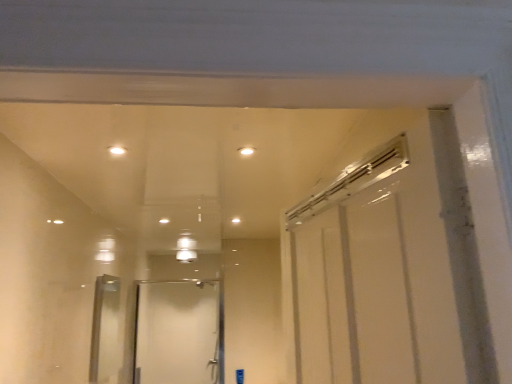
The height and width of the screenshot is (384, 512). What do you see at coordinates (246, 151) in the screenshot? I see `white glossy light at upper center, which is the 1th light from right to left` at bounding box center [246, 151].

What do you see at coordinates (117, 150) in the screenshot? I see `white glossy light at upper center, arranged as the 2th light when viewed from the right` at bounding box center [117, 150].

In order to click on clear glass door at center in this screenshot , I will do tap(177, 332).

You are a GUI agent. You are given a task and a screenshot of the screen. Output one action in this format:
    pyautogui.click(x=<x>, y=<y>)
    Task: Click on the white glossy light at upper center, which is the second light in left-to-right order
    
    Given the screenshot: What is the action you would take?
    pyautogui.click(x=246, y=151)

Is point (251, 150) closer or farther from the camera than point (120, 153)?

Point (251, 150).

Is white glossy light at upper center, which is the 1th light from right to left, bigger or smaller than white glossy light at upper center, the 1th light in the left-to-right sequence?

Considering their sizes, white glossy light at upper center, which is the 1th light from right to left, takes up less space than white glossy light at upper center, the 1th light in the left-to-right sequence.

From a real-world perspective, does white glossy light at upper center, which is the second light in left-to-right order, sit lower than white glossy light at upper center, arranged as the 2th light when viewed from the right?

Yes, from a real-world perspective, white glossy light at upper center, which is the second light in left-to-right order, is beneath white glossy light at upper center, arranged as the 2th light when viewed from the right.

From a real-world perspective, which is physically below, white glossy light at upper center, arranged as the 2th light when viewed from the right, or white glossy light at upper center, which is the 1th light from right to left?

From a 3D spatial view, white glossy light at upper center, which is the 1th light from right to left, is below.

Considering the positions of objects white glossy light at upper center, arranged as the 2th light when viewed from the right, and white glossy light at upper center, which is the 1th light from right to left, in the image provided, who is in front, white glossy light at upper center, arranged as the 2th light when viewed from the right, or white glossy light at upper center, which is the 1th light from right to left,?

white glossy light at upper center, arranged as the 2th light when viewed from the right, is closer to the camera.

In terms of height, does white glossy light at upper center, the 1th light in the left-to-right sequence, look taller or shorter compared to white glossy light at upper center, which is the 1th light from right to left?

In the image, white glossy light at upper center, the 1th light in the left-to-right sequence, appears to be taller than white glossy light at upper center, which is the 1th light from right to left.

Would you say white glossy light at upper center, the 1th light in the left-to-right sequence, is to the left or to the right of white glossy light at upper center, which is the 1th light from right to left, in the picture?

From the image, it's evident that white glossy light at upper center, the 1th light in the left-to-right sequence, is to the left of white glossy light at upper center, which is the 1th light from right to left.

Is clear glass door at center facing away from white glossy light at upper center, which is the second light in left-to-right order?

No, white glossy light at upper center, which is the second light in left-to-right order, is not at the back of clear glass door at center.

Considering the sizes of objects clear glass door at center and white glossy light at upper center, which is the second light in left-to-right order, in the image provided, who is wider, clear glass door at center or white glossy light at upper center, which is the second light in left-to-right order,?

Wider between the two is clear glass door at center.

Would you say white glossy light at upper center, which is the 1th light from right to left, is part of clear glass door at center's contents?

Actually, white glossy light at upper center, which is the 1th light from right to left, is outside clear glass door at center.

From the image's perspective, relative to white glossy light at upper center, which is the second light in left-to-right order, is clear glass door at center above or below?

Based on their image positions, clear glass door at center is located beneath white glossy light at upper center, which is the second light in left-to-right order.

Which of these two, white glossy light at upper center, which is the 1th light from right to left, or clear glass door at center, is wider?

With larger width is clear glass door at center.

Considering the sizes of white glossy light at upper center, which is the second light in left-to-right order, and clear glass door at center in the image, is white glossy light at upper center, which is the second light in left-to-right order, taller or shorter than clear glass door at center?

white glossy light at upper center, which is the second light in left-to-right order, is shorter than clear glass door at center.

The height and width of the screenshot is (384, 512). What are the coordinates of `door below the white glossy light at upper center, which is the 1th light from right to left (from the image's perspective)` in the screenshot? It's located at (177, 332).

Considering the relative positions of white glossy light at upper center, which is the second light in left-to-right order, and clear glass door at center in the image provided, is white glossy light at upper center, which is the second light in left-to-right order, behind clear glass door at center?

No, white glossy light at upper center, which is the second light in left-to-right order, is closer to the viewer.

From the image's perspective, which one is positioned higher, white glossy light at upper center, arranged as the 2th light when viewed from the right, or clear glass door at center?

From the image's view, white glossy light at upper center, arranged as the 2th light when viewed from the right, is above.

Is white glossy light at upper center, the 1th light in the left-to-right sequence, in front of clear glass door at center?

Yes, it is in front of clear glass door at center.

Looking at this image, considering the positions of objects white glossy light at upper center, arranged as the 2th light when viewed from the right, and clear glass door at center in the image provided, who is more to the left, white glossy light at upper center, arranged as the 2th light when viewed from the right, or clear glass door at center?

clear glass door at center is more to the left.

What's the angular difference between white glossy light at upper center, arranged as the 2th light when viewed from the right, and clear glass door at center's facing directions?

177 degrees separate the facing orientations of white glossy light at upper center, arranged as the 2th light when viewed from the right, and clear glass door at center.

From the image's perspective, is clear glass door at center over white glossy light at upper center, the 1th light in the left-to-right sequence?

Incorrect, from the image's perspective, clear glass door at center is lower than white glossy light at upper center, the 1th light in the left-to-right sequence.

What's the angular difference between clear glass door at center and white glossy light at upper center, the 1th light in the left-to-right sequence,'s facing directions?

177 degrees separate the facing orientations of clear glass door at center and white glossy light at upper center, the 1th light in the left-to-right sequence.

Considering the sizes of objects clear glass door at center and white glossy light at upper center, the 1th light in the left-to-right sequence, in the image provided, who is shorter, clear glass door at center or white glossy light at upper center, the 1th light in the left-to-right sequence,?

white glossy light at upper center, the 1th light in the left-to-right sequence, is shorter.

What are the coordinates of `light located underneath the white glossy light at upper center, arranged as the 2th light when viewed from the right (from a real-world perspective)` in the screenshot? It's located at (246, 151).

You are a GUI agent. You are given a task and a screenshot of the screen. Output one action in this format:
    pyautogui.click(x=<x>, y=<y>)
    Task: Click on the light that appears above the white glossy light at upper center, arranged as the 2th light when viewed from the right (from the image's perspective)
    
    Given the screenshot: What is the action you would take?
    pyautogui.click(x=246, y=151)

Looking at the image, which one is located further to white glossy light at upper center, arranged as the 2th light when viewed from the right, white glossy light at upper center, which is the second light in left-to-right order, or clear glass door at center?

clear glass door at center is positioned further to the anchor white glossy light at upper center, arranged as the 2th light when viewed from the right.

Estimate the real-world distances between objects in this image. Which object is further from white glossy light at upper center, which is the second light in left-to-right order, clear glass door at center or white glossy light at upper center, the 1th light in the left-to-right sequence?

clear glass door at center lies further to white glossy light at upper center, which is the second light in left-to-right order, than the other object.

Based on their spatial positions, is white glossy light at upper center, which is the second light in left-to-right order, or white glossy light at upper center, the 1th light in the left-to-right sequence, closer to clear glass door at center?

The object closer to clear glass door at center is white glossy light at upper center, the 1th light in the left-to-right sequence.

From the image, which object appears to be farther from white glossy light at upper center, which is the second light in left-to-right order, white glossy light at upper center, arranged as the 2th light when viewed from the right, or clear glass door at center?

The object further to white glossy light at upper center, which is the second light in left-to-right order, is clear glass door at center.

Estimate the real-world distances between objects in this image. Which object is closer to clear glass door at center, white glossy light at upper center, arranged as the 2th light when viewed from the right, or white glossy light at upper center, which is the 1th light from right to left?

white glossy light at upper center, arranged as the 2th light when viewed from the right, is closer to clear glass door at center.

From the image, which object appears to be nearer to white glossy light at upper center, arranged as the 2th light when viewed from the right, clear glass door at center or white glossy light at upper center, which is the 1th light from right to left?

The object closer to white glossy light at upper center, arranged as the 2th light when viewed from the right, is white glossy light at upper center, which is the 1th light from right to left.

I want to click on light between white glossy light at upper center, arranged as the 2th light when viewed from the right, and clear glass door at center in the front-back direction, so click(x=246, y=151).